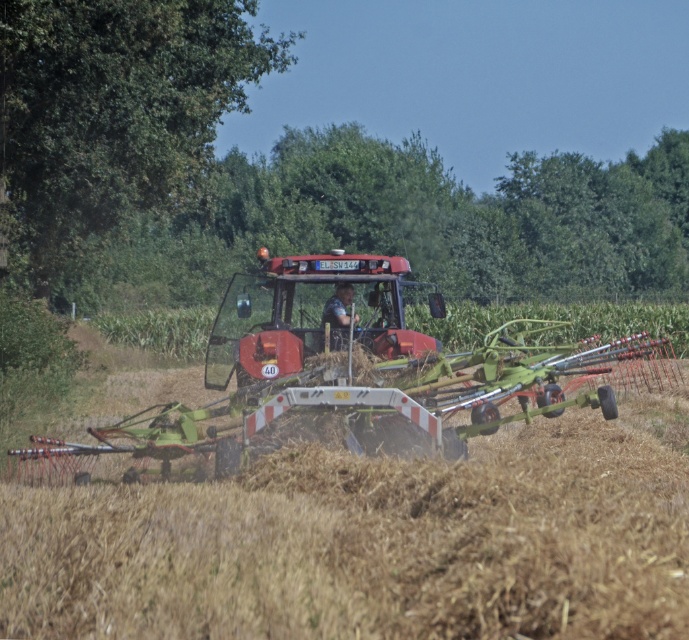
Based on the photo, you are a farmer operating the matte red tractor at center and need to check the condition of the brown grassy field at center. From your current position, in which direction should you look to see the field?

The brown grassy field at center is below the matte red tractor at center, so you should look downward to see the field.

You are standing in a rural area and see the brown grassy field at center and the matte red tractor at center. Which object is nearer to you?

The brown grassy field at center is closer to the viewer than the matte red tractor at center.